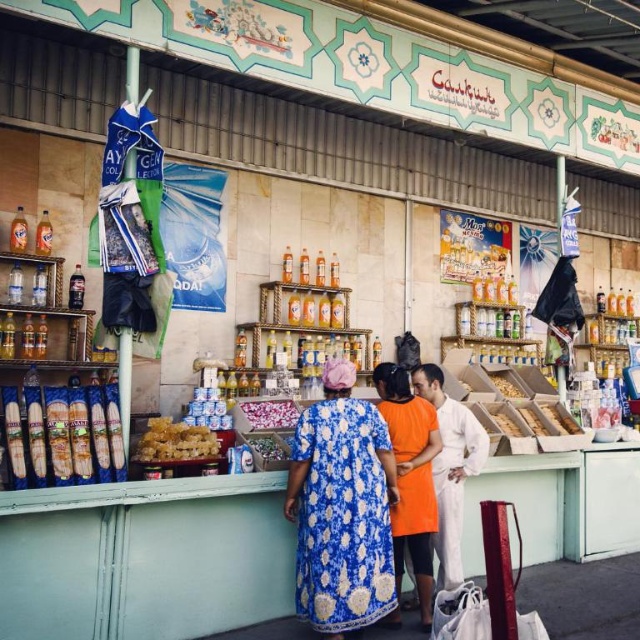
You are a customer browsing the market stall and want to pick up both the orange cotton dress at center and the white cotton shirt at center. Which item would you reach for first if you want to grab the one closer to you?

The orange cotton dress at center is closer to the viewer than the white cotton shirt at center, so you should reach for the orange cotton dress at center first.

You are a customer at the market stall and want to pick up both the orange cotton dress at center and the white cotton shirt at center. How far apart are these two items?

A: The orange cotton dress at center and the white cotton shirt at center are 39.11 centimeters apart.